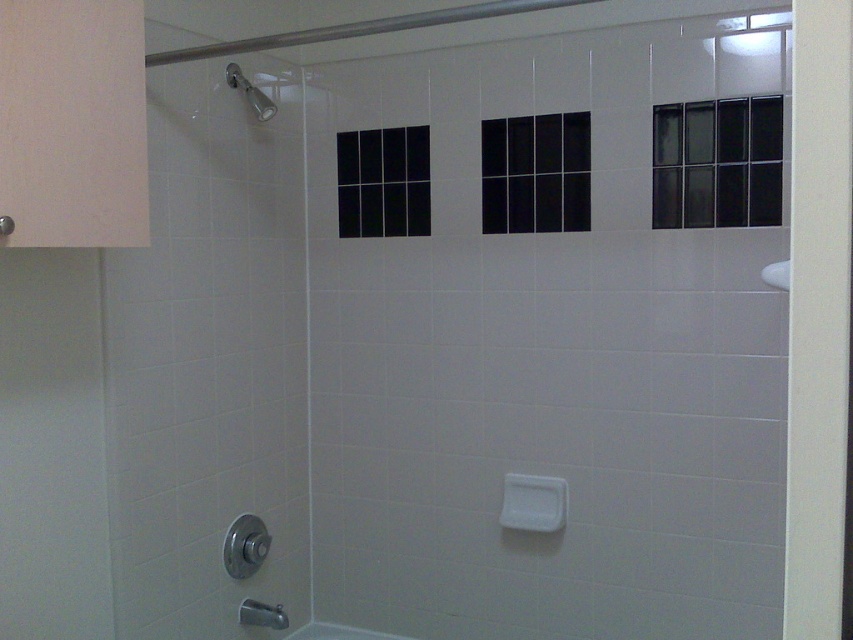
Question: Does white glossy bath at lower center appear on the left side of satin nickel showerhead at upper left?

Choices:
 (A) yes
 (B) no

Answer: (B)

Question: Which object appears closest to the camera in this image?

Choices:
 (A) black glass door at upper right
 (B) satin nickel showerhead at upper left

Answer: (A)

Question: Does white glossy bath at lower center appear on the right side of satin nickel showerhead at upper left?

Choices:
 (A) no
 (B) yes

Answer: (B)

Question: Which object is closer to the camera taking this photo?

Choices:
 (A) satin nickel showerhead at upper left
 (B) white glossy bath at lower center
 (C) white glossy sink at right

Answer: (C)

Question: Which of the following is the closest to the observer?

Choices:
 (A) (764, 275)
 (B) (660, 109)

Answer: (A)

Question: Is black glass door at upper right to the right of white glossy bath at lower center from the viewer's perspective?

Choices:
 (A) yes
 (B) no

Answer: (A)